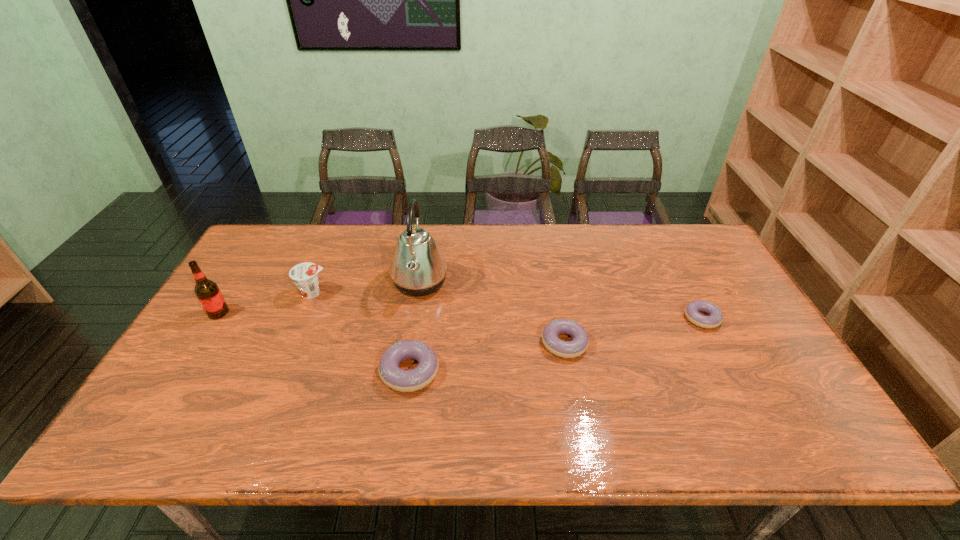
This screenshot has width=960, height=540. Find the location of `the leftmost doughnut`. the leftmost doughnut is located at coordinates (394, 377).

Identify the location of the third shortest object. Image resolution: width=960 pixels, height=540 pixels. 394,377.

In order to click on the fifth object from left to right in this screenshot , I will do `click(567, 349)`.

Find the location of `the second tallest doughnut`. the second tallest doughnut is located at coordinates (567, 349).

You are a GUI agent. You are given a task and a screenshot of the screen. Output one action in this format:
    pyautogui.click(x=<x>, y=<y>)
    Task: Click on the rightmost doughnut
    Image resolution: width=960 pixels, height=540 pixels.
    Given the screenshot: What is the action you would take?
    pyautogui.click(x=692, y=310)

The height and width of the screenshot is (540, 960). Find the location of `the shortest doughnut`. the shortest doughnut is located at coordinates (692, 310).

This screenshot has height=540, width=960. Find the location of `kettle`. kettle is located at coordinates (418, 268).

Where is `the second tallest object`? Image resolution: width=960 pixels, height=540 pixels. the second tallest object is located at coordinates (208, 293).

You are a GUI agent. You are given a task and a screenshot of the screen. Output one action in this format:
    pyautogui.click(x=<x>, y=<y>)
    Task: Click on the leftmost object
    The width and height of the screenshot is (960, 540).
    Given the screenshot: What is the action you would take?
    pyautogui.click(x=208, y=293)

Where is `yogurt`? This screenshot has width=960, height=540. yogurt is located at coordinates (304, 275).